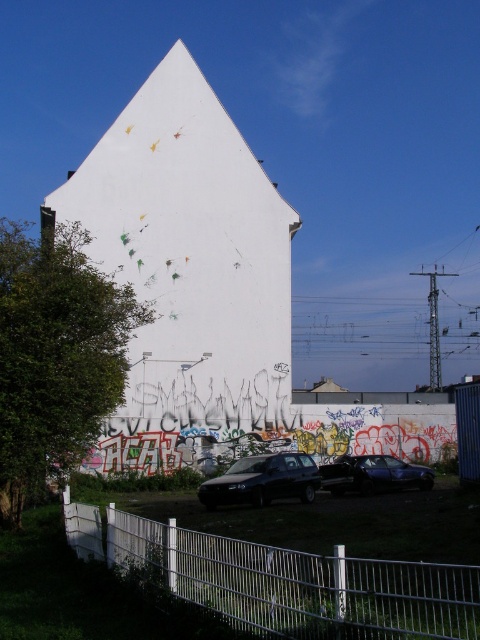
Question: Considering the real-world distances, which object is closest to the matte black car at center?

Choices:
 (A) white metal fence at lower center
 (B) metallic blue sedan at center

Answer: (B)

Question: Which is nearer to the matte black car at center?

Choices:
 (A) metallic blue sedan at center
 (B) white metal fence at lower center

Answer: (A)

Question: Can you confirm if white metal fence at lower center is bigger than metallic blue sedan at center?

Choices:
 (A) no
 (B) yes

Answer: (B)

Question: Among these objects, which one is nearest to the camera?

Choices:
 (A) matte black car at center
 (B) metallic blue sedan at center
 (C) white metal fence at lower center

Answer: (C)

Question: Considering the relative positions of white metal fence at lower center and metallic blue sedan at center in the image provided, where is white metal fence at lower center located with respect to metallic blue sedan at center?

Choices:
 (A) right
 (B) left

Answer: (B)

Question: Considering the relative positions of white metal fence at lower center and matte black car at center in the image provided, where is white metal fence at lower center located with respect to matte black car at center?

Choices:
 (A) right
 (B) left

Answer: (A)